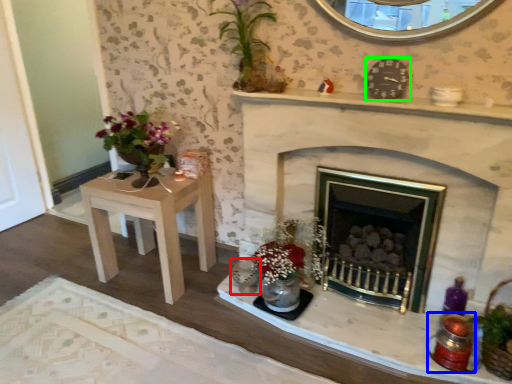
Question: Which is farther away from candle holder (highlighted by a red box)? candle holder (highlighted by a blue box) or clock (highlighted by a green box)?

Choices:
 (A) candle holder
 (B) clock

Answer: (B)